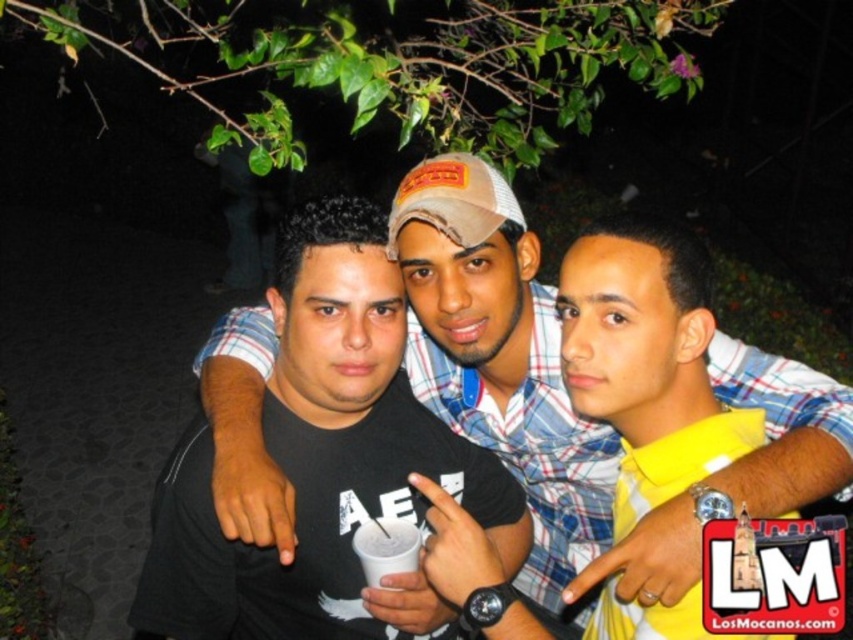
In the nighttime outdoor scene, there are three people posing for a photo. The person on the left is wearing a black T shirt with white text and graphics and holding a white disposable cup with a straw. The middle person is in a light blue and white plaid shirt and a beige baseball cap with red lettering, with his arm around the person on the right. Now, there is a specific point at coordinates (321, 461). Which object from the scene is located exactly at this point?

The black matte t shirt at center is located exactly at point (321, 461).

You are a photographer trying to adjust the focus of your camera. The black matte shirt at center and the white matte cup at center are both in the frame. Which object should you focus on first if you want to ensure the larger object is sharp?

The black matte shirt at center has a larger width than the white matte cup at center, so you should focus on the black matte shirt at center first to ensure the larger object is sharp.